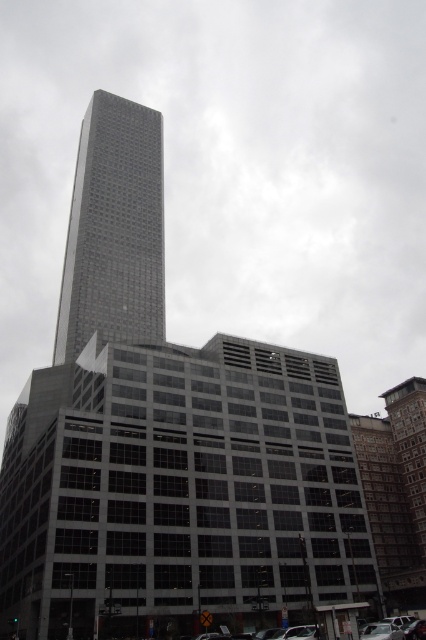
Is gray glass skyscraper at center in front of metallic silver car at lower right?

No, gray glass skyscraper at center is behind metallic silver car at lower right.

Based on the photo, can you confirm if gray glass skyscraper at center is wider than metallic silver car at lower right?

Yes.

Between point (141, 221) and point (379, 628), which one is positioned behind?

Positioned behind is point (141, 221).

Where is `gray glass skyscraper at center`? The width and height of the screenshot is (426, 640). gray glass skyscraper at center is located at coordinates [x=114, y=228].